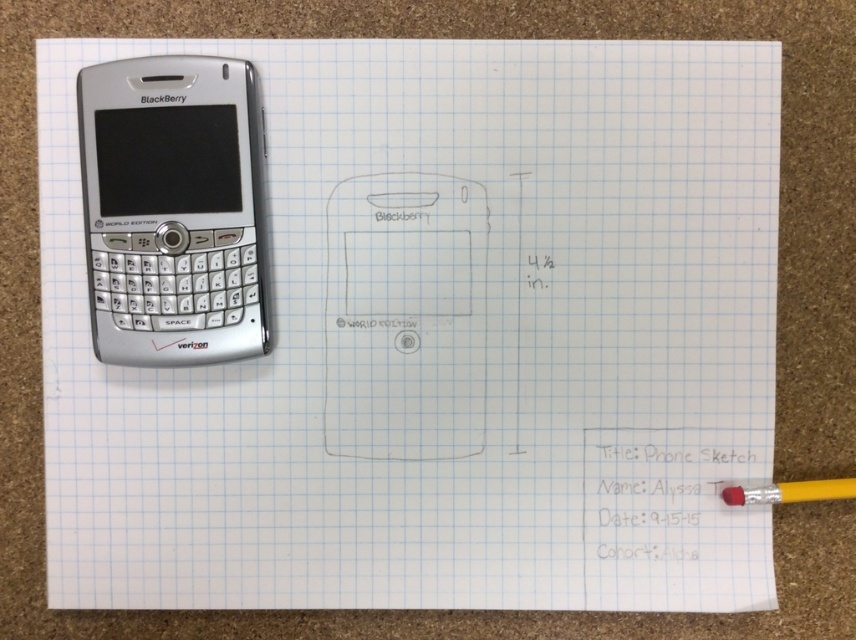
In the scene shown: You are organizing your desk and need to place the silver metallic blackberry at upper left and the red rubber eraser at bottom right into a drawer. The drawer has a maximum capacity of 5 inches in height. Can both items fit vertically without overlapping?

The silver metallic blackberry at upper left is bigger than the red rubber eraser at bottom right. Since the drawer can hold up to 5 inches, and the BlackBerry is 4.5 inches tall, both items can fit vertically as the combined height would be less than 5 inches.

From the picture: You are organizing a desk and need to place the red rubber eraser at bottom right and the rubber eraser at lower right. If you want to stack them, which one should be placed on top to ensure the one below is fully visible?

The red rubber eraser at bottom right should be placed on top because it is in front of the rubber eraser at lower right, so placing it above will allow the lower one to be seen underneath.